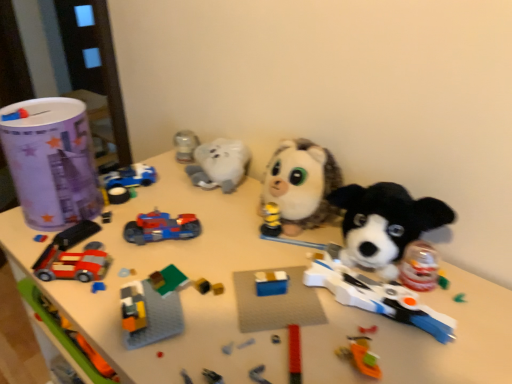
This screenshot has height=384, width=512. Identify the location of free area in between shiny plastic toy car at center, which is counted as the second toy, starting from the right, and blue plastic car at upper left, positioned as the 3th toy in left-to-right order. (140, 205).